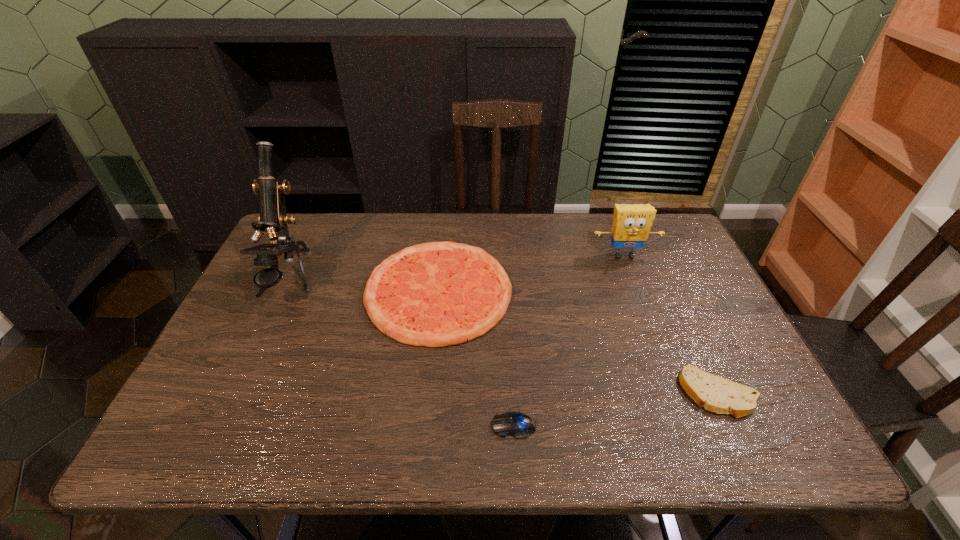
Find the location of a particular element. pita bread at the right edge is located at coordinates (716, 394).

The height and width of the screenshot is (540, 960). I want to click on object situated at the far left corner, so click(272, 219).

Image resolution: width=960 pixels, height=540 pixels. I want to click on object located at the far right corner, so click(x=631, y=224).

Where is `object present at the near right corner`? The width and height of the screenshot is (960, 540). object present at the near right corner is located at coordinates (716, 394).

You are a GUI agent. You are given a task and a screenshot of the screen. Output one action in this format:
    pyautogui.click(x=<x>, y=<y>)
    Task: Click on the vacant space at the far edge of the desktop
    
    Given the screenshot: What is the action you would take?
    pyautogui.click(x=454, y=224)

Locate an element on the screen. This screenshot has height=540, width=960. free spot at the near edge of the desktop is located at coordinates (672, 455).

Image resolution: width=960 pixels, height=540 pixels. Identify the location of free point at the right edge. (672, 327).

The image size is (960, 540). I want to click on free space at the far right corner, so click(673, 239).

This screenshot has height=540, width=960. Find the location of `free space at the near right corner of the desktop`. free space at the near right corner of the desktop is located at coordinates [x=740, y=419].

What are the coordinates of `vacant space in between the third shortest object and the computer mouse` in the screenshot? It's located at (476, 359).